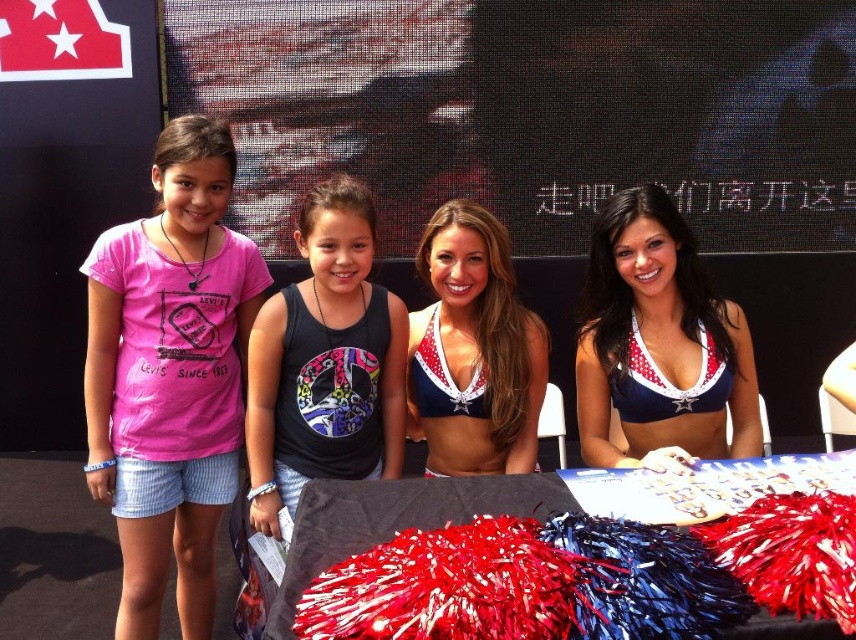
In the scene shown: You are standing in the middle of the image and want to walk towards the red and white bikini top at center. Which direction should you go?

Since the red and white bikini top at center is located at point 0.539 on the x axis and 0.771 on the y axis, you should move towards the lower right direction to reach it.